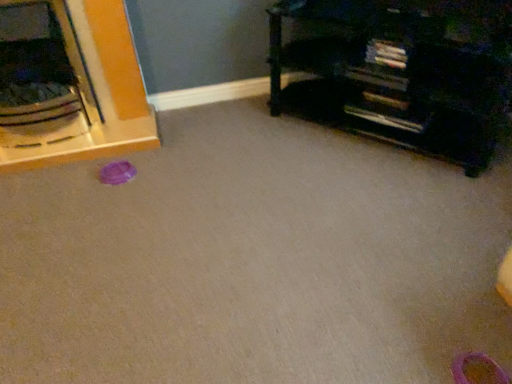
I want to click on brushed metal bowl at left, which appears as the first furniture when viewed from the left, so click(100, 94).

Based on the photo, is pink rubber shoe at lower right next to brushed metal bowl at left, which appears as the first furniture when viewed from the left, and touching it?

pink rubber shoe at lower right is not next to brushed metal bowl at left, which appears as the first furniture when viewed from the left, and they're not touching.

Is pink rubber shoe at lower right spatially inside brushed metal bowl at left, which appears as the first furniture when viewed from the left, or outside of it?

pink rubber shoe at lower right is outside brushed metal bowl at left, which appears as the first furniture when viewed from the left.

From a real-world perspective, is pink rubber shoe at lower right under brushed metal bowl at left, the second furniture viewed from the right?

Yes.

Is pink rubber shoe at lower right taller or shorter than brushed metal bowl at left, which appears as the first furniture when viewed from the left?

Clearly, pink rubber shoe at lower right is shorter compared to brushed metal bowl at left, which appears as the first furniture when viewed from the left.

Identify the location of furniture behind the black matte bookshelf at upper right, the 2th furniture when ordered from left to right. (100, 94).

Which object is closer to the camera taking this photo, brushed metal bowl at left, which appears as the first furniture when viewed from the left, or black matte bookshelf at upper right, the 1th furniture positioned from the right?

black matte bookshelf at upper right, the 1th furniture positioned from the right, is in front.

Considering the relative sizes of brushed metal bowl at left, which appears as the first furniture when viewed from the left, and black matte bookshelf at upper right, the 1th furniture positioned from the right, in the image provided, is brushed metal bowl at left, which appears as the first furniture when viewed from the left, bigger than black matte bookshelf at upper right, the 1th furniture positioned from the right,?

Yes, brushed metal bowl at left, which appears as the first furniture when viewed from the left, is bigger than black matte bookshelf at upper right, the 1th furniture positioned from the right.

Is brushed metal bowl at left, the second furniture viewed from the right, placed right next to black matte bookshelf at upper right, the 1th furniture positioned from the right?

There is a gap between brushed metal bowl at left, the second furniture viewed from the right, and black matte bookshelf at upper right, the 1th furniture positioned from the right.

From a real-world perspective, between pink rubber shoe at lower right and black matte bookshelf at upper right, the 1th furniture positioned from the right, who is vertically lower?

pink rubber shoe at lower right.

What's the angular difference between pink rubber shoe at lower right and black matte bookshelf at upper right, the 1th furniture positioned from the right,'s facing directions?

They differ by 46.2 degrees in their facing directions.

From the image's perspective, does pink rubber shoe at lower right appear higher than black matte bookshelf at upper right, the 2th furniture when ordered from left to right?

No, from the image's perspective, pink rubber shoe at lower right is not on top of black matte bookshelf at upper right, the 2th furniture when ordered from left to right.

From the picture: Would you say black matte bookshelf at upper right, the 2th furniture when ordered from left to right, is part of pink rubber shoe at lower right's contents?

No, black matte bookshelf at upper right, the 2th furniture when ordered from left to right, is located outside of pink rubber shoe at lower right.

Between black matte bookshelf at upper right, the 2th furniture when ordered from left to right, and pink rubber shoe at lower right, which one has more height?

black matte bookshelf at upper right, the 2th furniture when ordered from left to right, is taller.

Is black matte bookshelf at upper right, the 2th furniture when ordered from left to right, smaller than pink rubber shoe at lower right?

Actually, black matte bookshelf at upper right, the 2th furniture when ordered from left to right, might be larger than pink rubber shoe at lower right.

You are a GUI agent. You are given a task and a screenshot of the screen. Output one action in this format:
    pyautogui.click(x=<x>, y=<y>)
    Task: Click on the 1st furniture behind the pink rubber shoe at lower right
    The image size is (512, 384).
    Given the screenshot: What is the action you would take?
    pyautogui.click(x=402, y=73)

Is black matte bookshelf at upper right, the 2th furniture when ordered from left to right, with pink rubber shoe at lower right?

No.

From the image's perspective, between black matte bookshelf at upper right, the 2th furniture when ordered from left to right, and brushed metal bowl at left, the second furniture viewed from the right, who is located below?

black matte bookshelf at upper right, the 2th furniture when ordered from left to right, from the image's perspective.

Identify the location of furniture located on the left of black matte bookshelf at upper right, the 2th furniture when ordered from left to right. (100, 94).

Measure the distance from black matte bookshelf at upper right, the 2th furniture when ordered from left to right, to brushed metal bowl at left, the second furniture viewed from the right.

black matte bookshelf at upper right, the 2th furniture when ordered from left to right, is 38.47 inches from brushed metal bowl at left, the second furniture viewed from the right.

In terms of width, does black matte bookshelf at upper right, the 2th furniture when ordered from left to right, look wider or thinner when compared to brushed metal bowl at left, the second furniture viewed from the right?

black matte bookshelf at upper right, the 2th furniture when ordered from left to right, is thinner than brushed metal bowl at left, the second furniture viewed from the right.

Can you confirm if brushed metal bowl at left, which appears as the first furniture when viewed from the left, is positioned to the left of pink rubber shoe at lower right?

Yes, brushed metal bowl at left, which appears as the first furniture when viewed from the left, is to the left of pink rubber shoe at lower right.

Considering the positions of objects brushed metal bowl at left, which appears as the first furniture when viewed from the left, and pink rubber shoe at lower right in the image provided, who is behind, brushed metal bowl at left, which appears as the first furniture when viewed from the left, or pink rubber shoe at lower right?

brushed metal bowl at left, which appears as the first furniture when viewed from the left, is further away from the camera.

Between brushed metal bowl at left, which appears as the first furniture when viewed from the left, and pink rubber shoe at lower right, which one has larger width?

Wider between the two is brushed metal bowl at left, which appears as the first furniture when viewed from the left.

Looking at this image, is brushed metal bowl at left, the second furniture viewed from the right, not close to pink rubber shoe at lower right?

Yes, brushed metal bowl at left, the second furniture viewed from the right, and pink rubber shoe at lower right are located far from each other.

The height and width of the screenshot is (384, 512). Identify the location of the 2nd furniture to the left of the pink rubber shoe at lower right, starting your count from the anchor. (100, 94).

Where is `furniture on the right of brushed metal bowl at left, the second furniture viewed from the right`? The image size is (512, 384). furniture on the right of brushed metal bowl at left, the second furniture viewed from the right is located at coordinates (402, 73).

Looking at this image, considering their positions, is brushed metal bowl at left, the second furniture viewed from the right, positioned closer to pink rubber shoe at lower right than black matte bookshelf at upper right, the 2th furniture when ordered from left to right?

Based on the image, black matte bookshelf at upper right, the 2th furniture when ordered from left to right, appears to be nearer to pink rubber shoe at lower right.

Which object lies nearer to the anchor point brushed metal bowl at left, the second furniture viewed from the right, black matte bookshelf at upper right, the 2th furniture when ordered from left to right, or pink rubber shoe at lower right?

black matte bookshelf at upper right, the 2th furniture when ordered from left to right, lies closer to brushed metal bowl at left, the second furniture viewed from the right, than the other object.

Consider the image. Which object lies nearer to the anchor point black matte bookshelf at upper right, the 2th furniture when ordered from left to right, brushed metal bowl at left, the second furniture viewed from the right, or pink rubber shoe at lower right?

brushed metal bowl at left, the second furniture viewed from the right.

In the scene shown: Looking at the image, which one is located closer to pink rubber shoe at lower right, black matte bookshelf at upper right, the 1th furniture positioned from the right, or brushed metal bowl at left, the second furniture viewed from the right?

black matte bookshelf at upper right, the 1th furniture positioned from the right, is positioned closer to the anchor pink rubber shoe at lower right.

Which object lies further to the anchor point brushed metal bowl at left, which appears as the first furniture when viewed from the left, pink rubber shoe at lower right or black matte bookshelf at upper right, the 1th furniture positioned from the right?

Among the two, pink rubber shoe at lower right is located further to brushed metal bowl at left, which appears as the first furniture when viewed from the left.

Considering their positions, is pink rubber shoe at lower right positioned closer to black matte bookshelf at upper right, the 2th furniture when ordered from left to right, than brushed metal bowl at left, which appears as the first furniture when viewed from the left?

brushed metal bowl at left, which appears as the first furniture when viewed from the left, is positioned closer to the anchor black matte bookshelf at upper right, the 2th furniture when ordered from left to right.

Where is `furniture between brushed metal bowl at left, which appears as the first furniture when viewed from the left, and pink rubber shoe at lower right, in the horizontal direction`? This screenshot has width=512, height=384. furniture between brushed metal bowl at left, which appears as the first furniture when viewed from the left, and pink rubber shoe at lower right, in the horizontal direction is located at coordinates (402, 73).